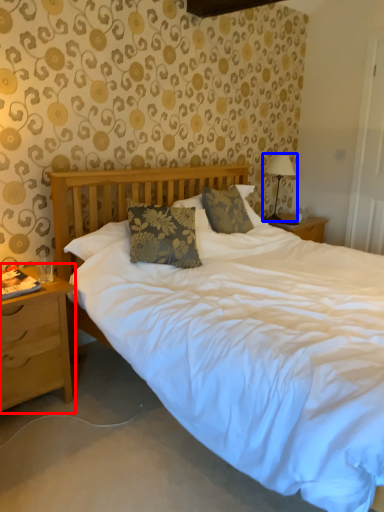
Question: Among these objects, which one is farthest to the camera, nightstand (highlighted by a red box) or table lamp (highlighted by a blue box)?

Choices:
 (A) nightstand
 (B) table lamp

Answer: (B)